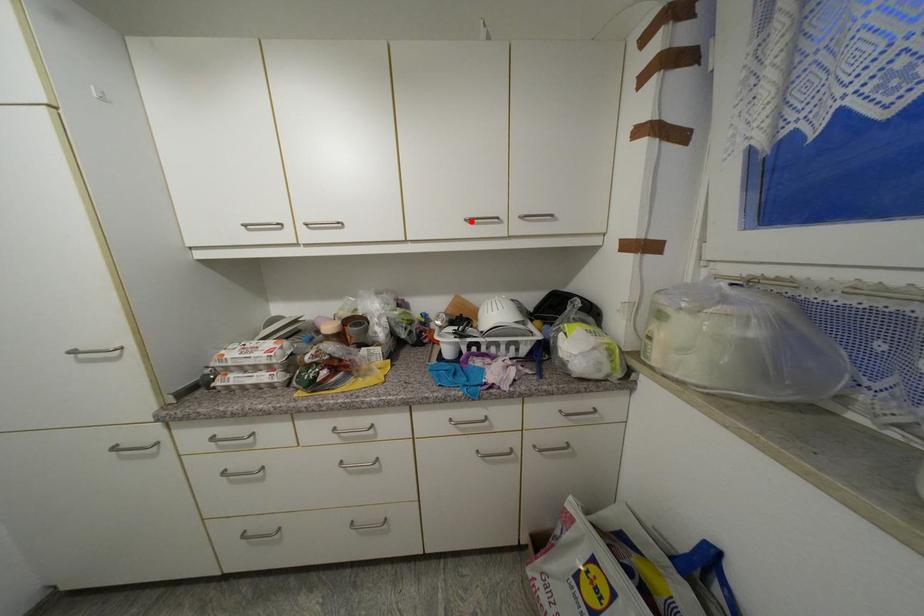
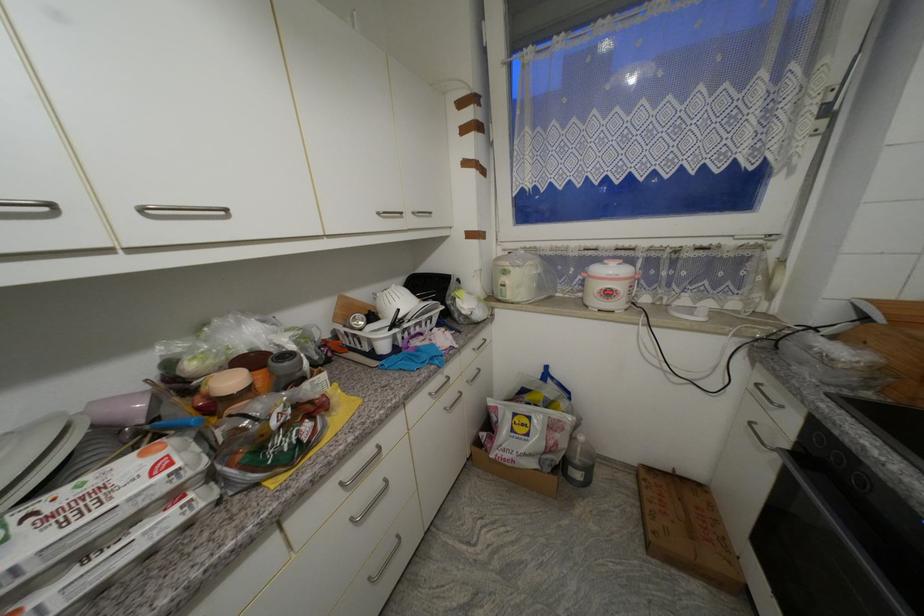
The point at the highlighted location is marked in the first image. Where is the corresponding point in the second image?

(383, 215)